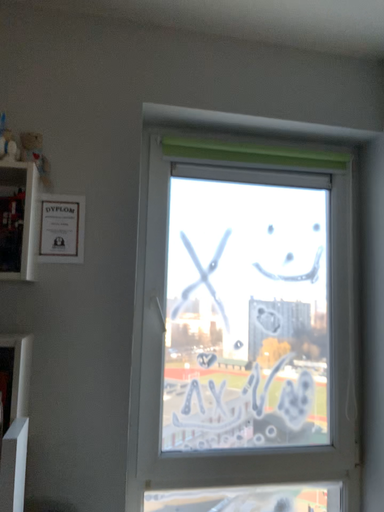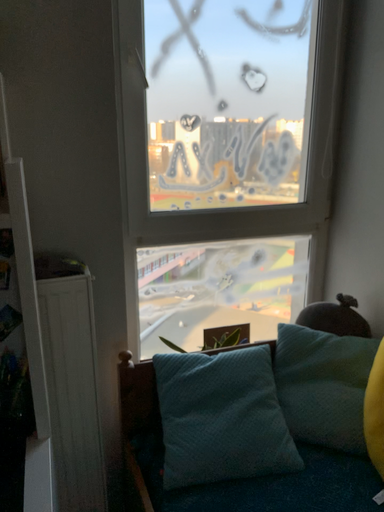
Question: Which way did the camera rotate in the video?

Choices:
 (A) rotated left
 (B) rotated right

Answer: (B)